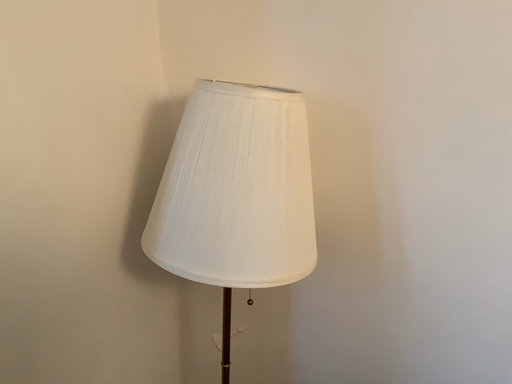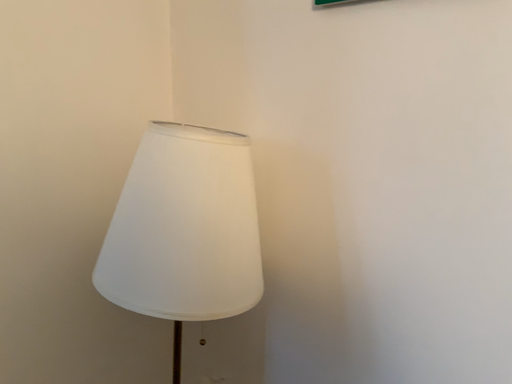
Question: Which way did the camera rotate in the video?

Choices:
 (A) rotated upward
 (B) rotated downward

Answer: (A)